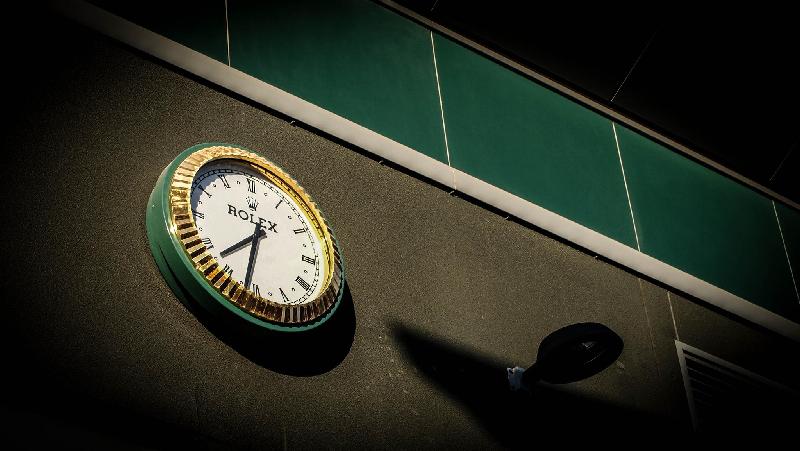
At what (x,y) coordinates should I click in order to perform the action: click on wall. Please return your answer as a coordinate pair (x, y). The image size is (800, 451). Looking at the image, I should click on (416, 369).